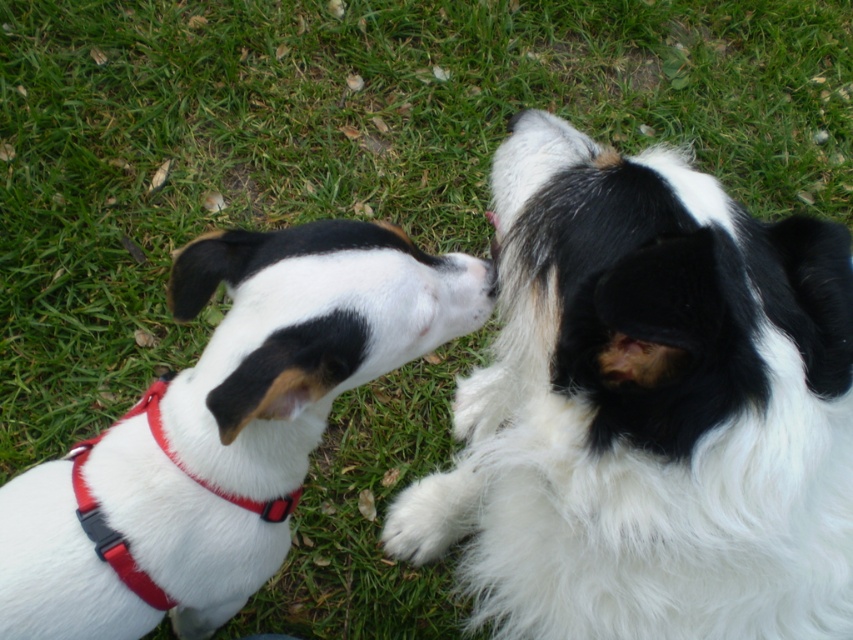
Does white fur dog at center come behind red fabric neckband at lower left?

No, white fur dog at center is in front of red fabric neckband at lower left.

Does white fur dog at center appear on the left side of red fabric neckband at lower left?

Correct, you'll find white fur dog at center to the left of red fabric neckband at lower left.

The width and height of the screenshot is (853, 640). In order to click on white fur dog at center in this screenshot , I will do `click(224, 429)`.

Is white fluffy dog at upper center smaller than white fur dog at center?

No, white fluffy dog at upper center is not smaller than white fur dog at center.

Who is positioned more to the right, white fluffy dog at upper center or white fur dog at center?

From the viewer's perspective, white fluffy dog at upper center appears more on the right side.

The image size is (853, 640). Describe the element at coordinates (648, 408) in the screenshot. I see `white fluffy dog at upper center` at that location.

Identify the location of white fluffy dog at upper center. (648, 408).

Which of these two, white fluffy dog at upper center or red fabric neckband at lower left, stands shorter?

red fabric neckband at lower left

Is point (724, 195) less distant than point (155, 420)?

Yes, it is in front of point (155, 420).

This screenshot has height=640, width=853. In order to click on white fluffy dog at upper center in this screenshot , I will do `click(648, 408)`.